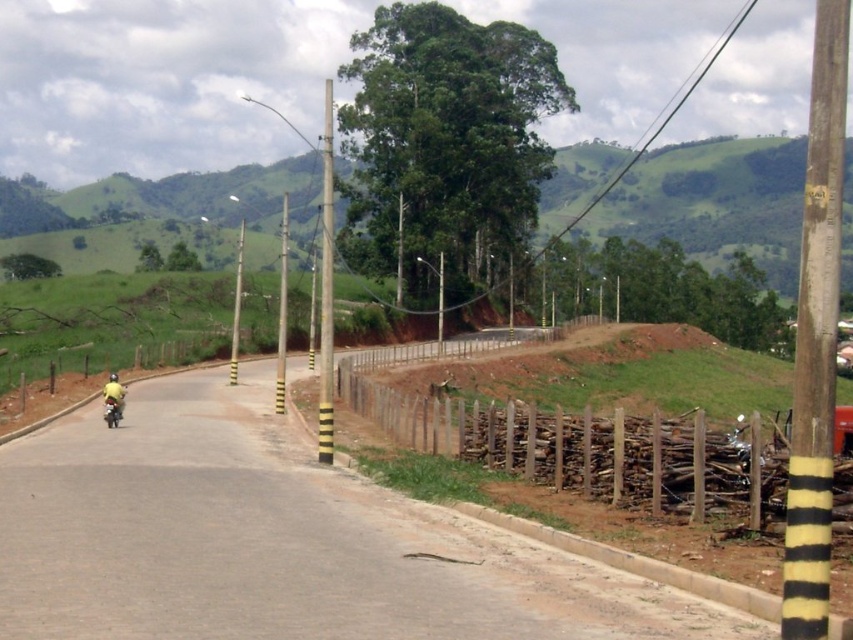
Question: Estimate the real-world distances between objects in this image. Which object is closer to the yellow fabric person at left?

Choices:
 (A) brown dirt track at lower right
 (B) green grassy hill at upper center

Answer: (A)

Question: Can you confirm if brown dirt track at lower right is positioned above yellow fabric person at left?

Choices:
 (A) no
 (B) yes

Answer: (A)

Question: Can you confirm if brown dirt track at lower right is smaller than yellow fabric person at left?

Choices:
 (A) no
 (B) yes

Answer: (A)

Question: Which point is farther to the camera?

Choices:
 (A) green grassy hill at upper center
 (B) yellow fabric person at left
 (C) brown dirt track at lower right

Answer: (B)

Question: Is the position of brown dirt track at lower right more distant than that of yellow fabric person at left?

Choices:
 (A) yes
 (B) no

Answer: (B)

Question: Which is nearer to the brown dirt track at lower right?

Choices:
 (A) yellow fabric person at left
 (B) green grassy hill at upper center

Answer: (A)